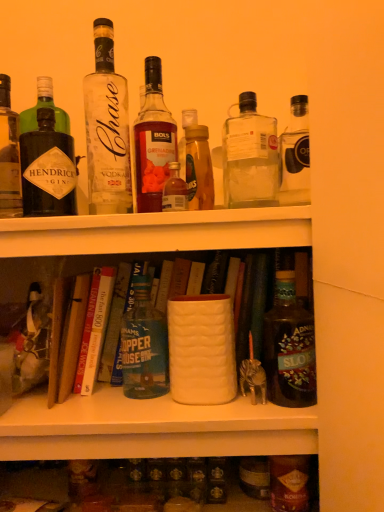
Question: In which direction should I rotate to look at clear glass bottle at upper center, the 2th bottle when ordered from left to right?

Choices:
 (A) left
 (B) right

Answer: (A)

Question: Is hardcover book at center, positioned as the first book in right-to-left order, not inside dark brown glass bottle at right, acting as the eighth bottle starting from the left?

Choices:
 (A) no
 (B) yes

Answer: (B)

Question: Is hardcover book at center, positioned as the first book in right-to-left order, smaller than dark brown glass bottle at right, acting as the 1th bottle starting from the right?

Choices:
 (A) yes
 (B) no

Answer: (B)

Question: Is the depth of hardcover book at center, positioned as the first book in right-to-left order, less than that of dark brown glass bottle at right, acting as the eighth bottle starting from the left?

Choices:
 (A) yes
 (B) no

Answer: (B)

Question: Is hardcover book at center, the third book in the left-to-right sequence, bigger than dark brown glass bottle at right, acting as the eighth bottle starting from the left?

Choices:
 (A) no
 (B) yes

Answer: (B)

Question: Considering the relative positions of hardcover book at center, positioned as the first book in right-to-left order, and dark brown glass bottle at right, acting as the 1th bottle starting from the right, in the image provided, is hardcover book at center, positioned as the first book in right-to-left order, behind dark brown glass bottle at right, acting as the 1th bottle starting from the right,?

Choices:
 (A) yes
 (B) no

Answer: (A)

Question: Does hardcover book at center, positioned as the first book in right-to-left order, have a greater height compared to dark brown glass bottle at right, acting as the 1th bottle starting from the right?

Choices:
 (A) yes
 (B) no

Answer: (A)

Question: From the image's perspective, is matte black gin bottle at left, which appears as the 8th bottle when viewed from the right, below hardcover book at center, acting as the second book starting from the left?

Choices:
 (A) yes
 (B) no

Answer: (B)

Question: Is matte black gin bottle at left, the first bottle in the left-to-right sequence, shorter than hardcover book at center, the 2th book positioned from the right?

Choices:
 (A) no
 (B) yes

Answer: (A)

Question: From the image's perspective, does matte black gin bottle at left, the first bottle in the left-to-right sequence, appear higher than hardcover book at center, the 2th book positioned from the right?

Choices:
 (A) no
 (B) yes

Answer: (B)

Question: Is matte black gin bottle at left, the first bottle in the left-to-right sequence, wider than hardcover book at center, acting as the second book starting from the left?

Choices:
 (A) yes
 (B) no

Answer: (B)

Question: Could you tell me if matte black gin bottle at left, the first bottle in the left-to-right sequence, is turned towards hardcover book at center, the 2th book positioned from the right?

Choices:
 (A) no
 (B) yes

Answer: (A)

Question: Is there a large distance between matte black gin bottle at left, which appears as the 8th bottle when viewed from the right, and hardcover book at center, acting as the second book starting from the left?

Choices:
 (A) no
 (B) yes

Answer: (A)

Question: Could green glass bottle at center, which is the 6th bottle from right to left, be considered to be inside clear glass bottle at upper center, marked as the seventh bottle in a right-to-left arrangement?

Choices:
 (A) yes
 (B) no

Answer: (B)